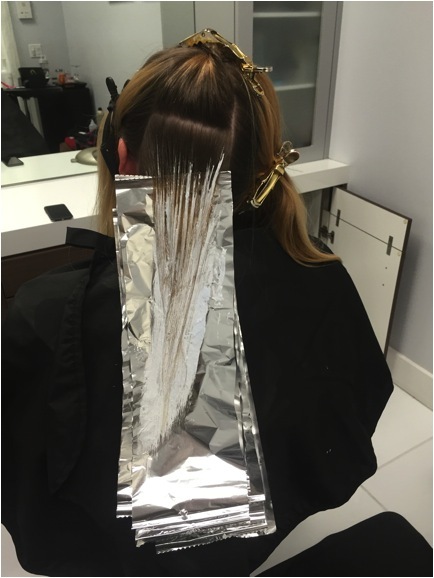
Locate an element on the screen. The height and width of the screenshot is (578, 434). floor is located at coordinates (417, 458).